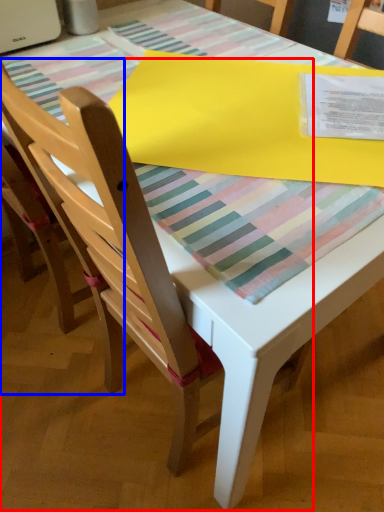
Question: Among these objects, which one is farthest to the camera, chair (highlighted by a red box) or chair (highlighted by a blue box)?

Choices:
 (A) chair
 (B) chair

Answer: (B)